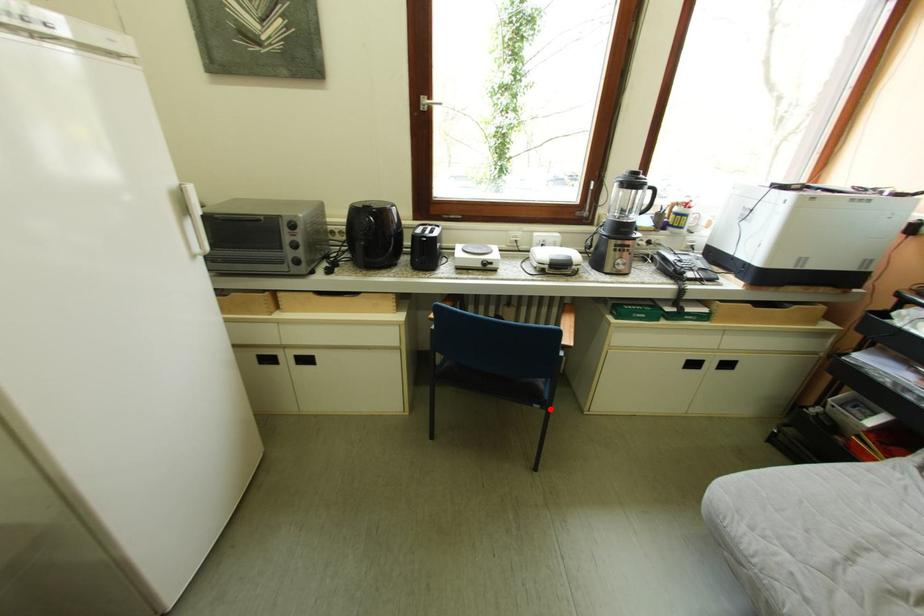
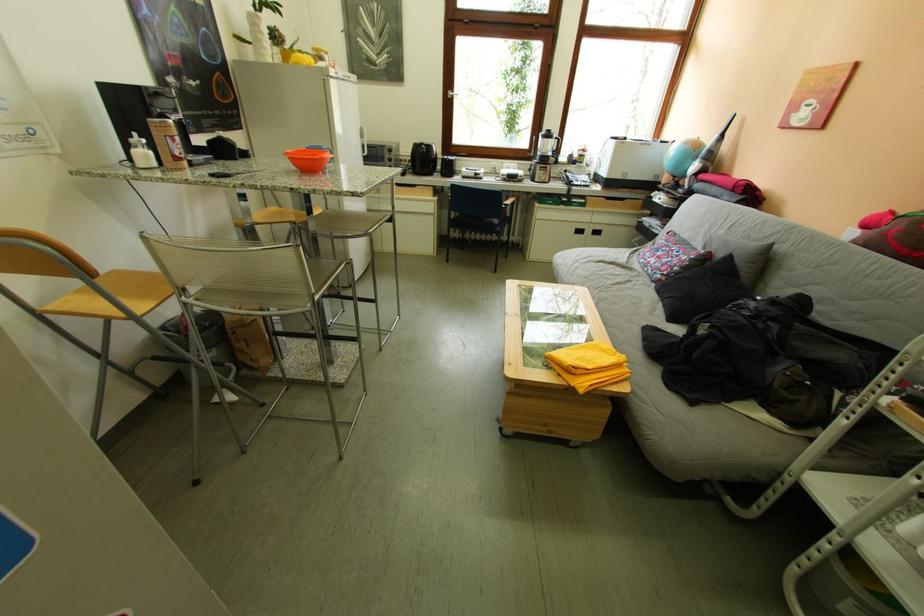
Find the pixel in the second image that matches the highlighted location in the first image.

(507, 238)